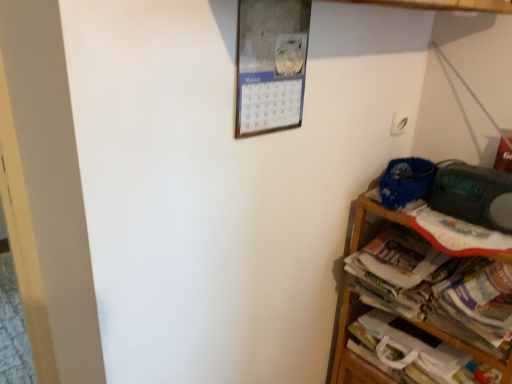
Question: Is the position of white paper magazine at right less distant than that of white paper book at lower right?

Choices:
 (A) yes
 (B) no

Answer: (B)

Question: From a real-world perspective, is white paper magazine at right physically below white paper book at lower right?

Choices:
 (A) yes
 (B) no

Answer: (B)

Question: Is white paper magazine at right oriented towards white paper book at lower right?

Choices:
 (A) yes
 (B) no

Answer: (B)

Question: Is white paper magazine at right not close to white paper book at lower right?

Choices:
 (A) yes
 (B) no

Answer: (B)

Question: Is white paper magazine at right thinner than white paper book at lower right?

Choices:
 (A) yes
 (B) no

Answer: (B)

Question: From the image's perspective, is white paper magazine at right above or below wooden shelf at right?

Choices:
 (A) above
 (B) below

Answer: (A)

Question: Choose the correct answer: Is white paper magazine at right inside wooden shelf at right or outside it?

Choices:
 (A) inside
 (B) outside

Answer: (A)

Question: Considering the positions of white paper magazine at right and wooden shelf at right in the image, is white paper magazine at right bigger or smaller than wooden shelf at right?

Choices:
 (A) big
 (B) small

Answer: (B)

Question: Is white paper magazine at right taller or shorter than wooden shelf at right?

Choices:
 (A) short
 (B) tall

Answer: (A)

Question: Based on their positions, is white paper book at lower right located to the left or right of wooden shelf at right?

Choices:
 (A) right
 (B) left

Answer: (A)

Question: From the image's perspective, relative to wooden shelf at right, is white paper book at lower right above or below?

Choices:
 (A) below
 (B) above

Answer: (A)

Question: Is white paper book at lower right bigger or smaller than wooden shelf at right?

Choices:
 (A) small
 (B) big

Answer: (A)

Question: Considering their positions, is white paper book at lower right located in front of or behind wooden shelf at right?

Choices:
 (A) front
 (B) behind

Answer: (B)

Question: Is white paper book at lower right inside or outside of white paper magazine at right?

Choices:
 (A) outside
 (B) inside

Answer: (A)

Question: Looking at the image, does white paper book at lower right seem bigger or smaller compared to white paper magazine at right?

Choices:
 (A) big
 (B) small

Answer: (B)